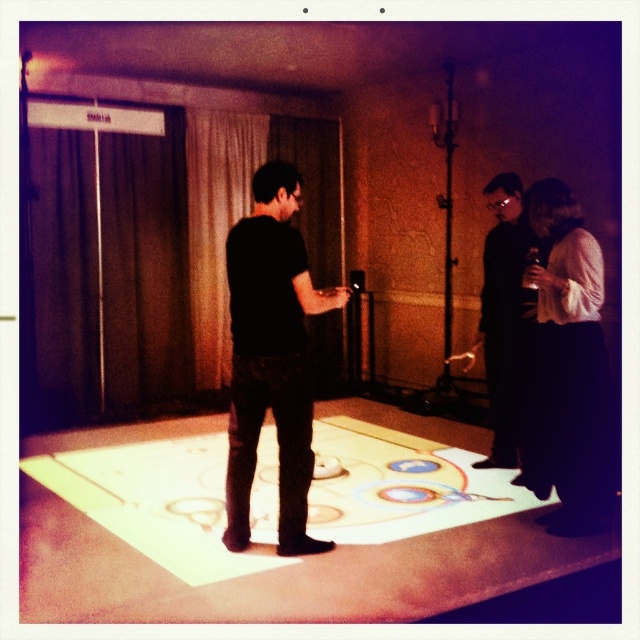
Question: Estimate the real-world distances between objects in this image. Which object is closer to the white matte dress at right?

Choices:
 (A) black matte suit at right
 (B) black matte shirt at center

Answer: (A)

Question: Can you confirm if white matte dress at right is positioned above black matte suit at right?

Choices:
 (A) yes
 (B) no

Answer: (B)

Question: Is black matte shirt at center to the left of black matte suit at right from the viewer's perspective?

Choices:
 (A) no
 (B) yes

Answer: (B)

Question: Based on their relative distances, which object is farther from the black matte suit at right?

Choices:
 (A) black matte shirt at center
 (B) white matte dress at right

Answer: (A)

Question: Does black matte shirt at center appear on the right side of black matte suit at right?

Choices:
 (A) no
 (B) yes

Answer: (A)

Question: Which object is positioned closest to the black matte shirt at center?

Choices:
 (A) black matte suit at right
 (B) white matte dress at right

Answer: (B)